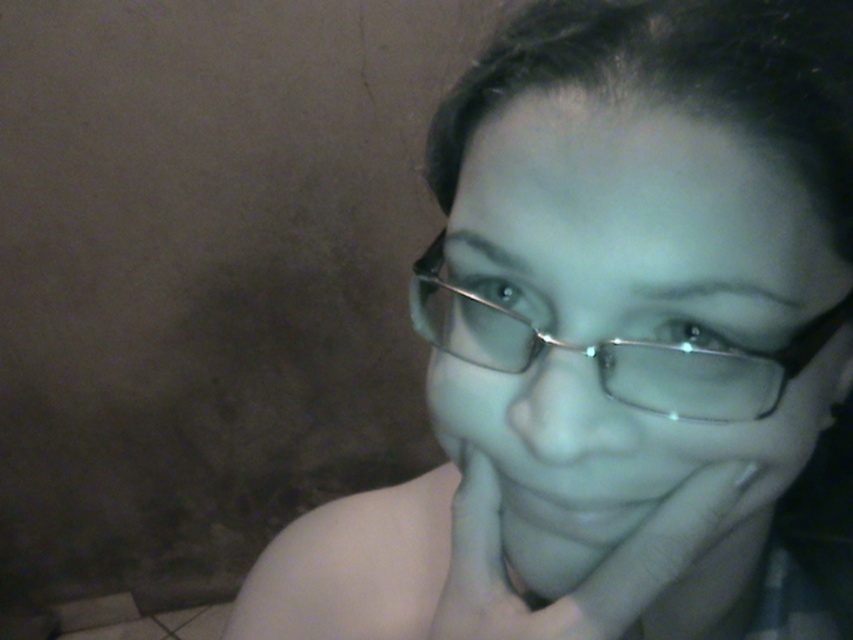
You are a photographer adjusting the focus of your camera. You want to capture both the smooth skin hand at center and the metallic frame glasses at center in sharp focus. Given that your camera can only focus on objects within a 2.5 inch range, will both objects be in focus?

The smooth skin hand at center is 2.60 inches from metallic frame glasses at center. Since the camera can only focus within a 2.5 inch range, the distance between them exceeds this limit. Therefore, both objects cannot be in sharp focus simultaneously.

Based on the scene description, can you determine the position of the smooth skin hand at center relative to the metallic frame glasses at center?

The smooth skin hand at center is to the right of the metallic frame glasses at center.

You are a photographer analyzing the composition of this image. You notice a point at coordinates point (637, 227). Based on the scene description, where is this point located?

The point (637, 227) is located on the clear plastic glasses at center.